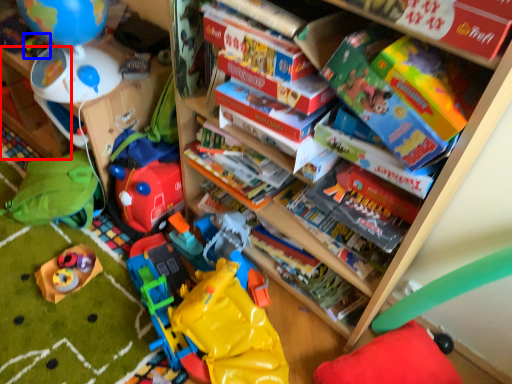
Question: Which of the following is the closest to the observer, shelf (highlighted by a red box) or toy (highlighted by a blue box)?

Choices:
 (A) shelf
 (B) toy

Answer: (B)